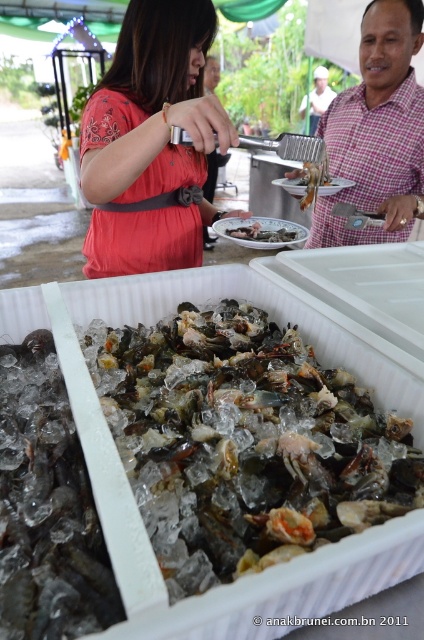
Where is `translucent ice at center`? translucent ice at center is located at coordinates (245, 442).

Is translucent ice at center smaller than translucent glass shrimp at center?

Incorrect, translucent ice at center is not smaller in size than translucent glass shrimp at center.

Locate an element on the screen. translucent ice at center is located at coordinates (245, 442).

Is matte pink dress at center taller than glossy plastic crab at center?

Correct, matte pink dress at center is much taller as glossy plastic crab at center.

In the scene shown: Is matte pink dress at center shorter than glossy plastic crab at center?

In fact, matte pink dress at center may be taller than glossy plastic crab at center.

Is point (105, 228) less distant than point (261, 225)?

Yes, it is.

This screenshot has height=640, width=424. I want to click on matte pink dress at center, so pyautogui.click(x=151, y=141).

Based on the photo, does matte pink dress at center appear on the right side of plaid fabric shirt at upper right?

In fact, matte pink dress at center is to the left of plaid fabric shirt at upper right.

Does matte pink dress at center have a lesser height compared to plaid fabric shirt at upper right?

Correct, matte pink dress at center is not as tall as plaid fabric shirt at upper right.

What are the coordinates of `matte pink dress at center` in the screenshot? It's located at (151, 141).